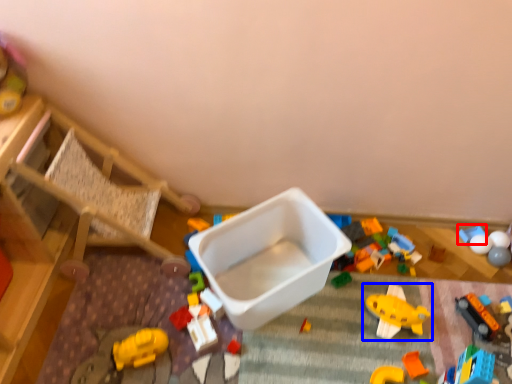
Question: Which point is further to the camera, toy (highlighted by a red box) or toy (highlighted by a blue box)?

Choices:
 (A) toy
 (B) toy

Answer: (A)